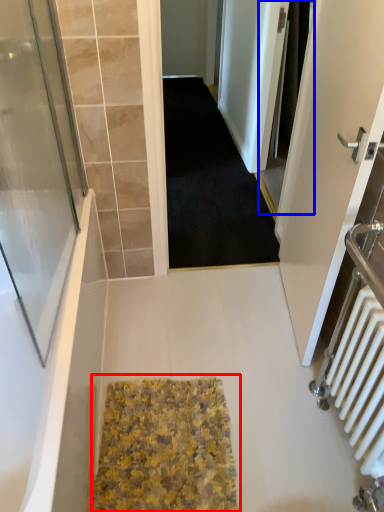
Question: Which object is closer to the camera taking this photo, bath mat (highlighted by a red box) or screen door (highlighted by a blue box)?

Choices:
 (A) bath mat
 (B) screen door

Answer: (A)